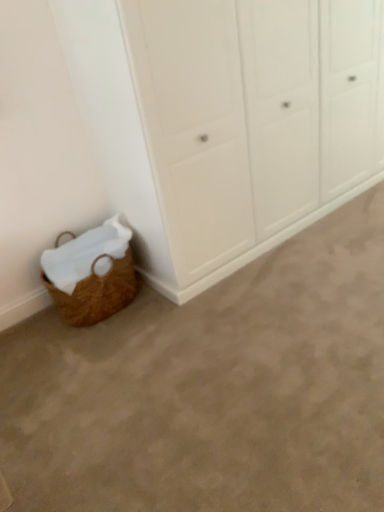
Question: From the image's perspective, is white matte cupboard at lower left over brown woven basket at lower left?

Choices:
 (A) no
 (B) yes

Answer: (B)

Question: Is the depth of white matte cupboard at lower left greater than that of brown woven basket at lower left?

Choices:
 (A) no
 (B) yes

Answer: (B)

Question: Is white matte cupboard at lower left facing away from brown woven basket at lower left?

Choices:
 (A) yes
 (B) no

Answer: (B)

Question: Does white matte cupboard at lower left appear on the left side of brown woven basket at lower left?

Choices:
 (A) yes
 (B) no

Answer: (B)

Question: Can you confirm if white matte cupboard at lower left is smaller than brown woven basket at lower left?

Choices:
 (A) yes
 (B) no

Answer: (B)

Question: Is white matte cupboard at lower left wider or thinner than brown woven basket at lower left?

Choices:
 (A) wide
 (B) thin

Answer: (A)

Question: In terms of height, does white matte cupboard at lower left look taller or shorter compared to brown woven basket at lower left?

Choices:
 (A) tall
 (B) short

Answer: (A)

Question: Is white matte cupboard at lower left to the left or to the right of brown woven basket at lower left in the image?

Choices:
 (A) right
 (B) left

Answer: (A)

Question: Is point (314, 147) positioned closer to the camera than point (92, 240)?

Choices:
 (A) closer
 (B) farther

Answer: (B)

Question: Is white matte cupboard at lower left to the left or to the right of brown woven basket at lower left in the image?

Choices:
 (A) left
 (B) right

Answer: (B)

Question: Considering the positions of white matte cupboard at lower left and brown woven basket at lower left in the image, is white matte cupboard at lower left taller or shorter than brown woven basket at lower left?

Choices:
 (A) tall
 (B) short

Answer: (A)

Question: Looking at their shapes, would you say white matte cupboard at lower left is wider or thinner than brown woven basket at lower left?

Choices:
 (A) wide
 (B) thin

Answer: (B)

Question: Is white matte cupboard at lower left in front of or behind brown woven basket at lower left in the image?

Choices:
 (A) behind
 (B) front

Answer: (A)

Question: Based on their positions, is brown woven basket at lower left located to the left or right of brown woven basket at lower left?

Choices:
 (A) left
 (B) right

Answer: (A)

Question: Which is correct: brown woven basket at lower left is inside brown woven basket at lower left, or outside of it?

Choices:
 (A) outside
 (B) inside

Answer: (A)